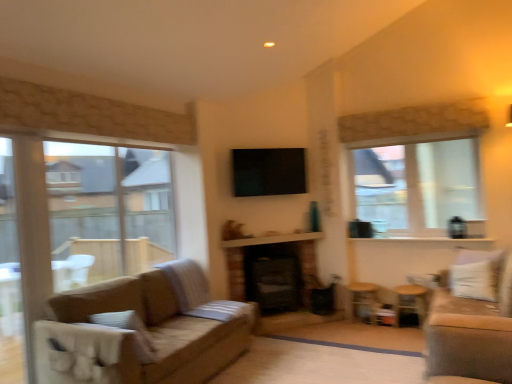
Question: Is white textured balcony at center wider or thinner than wooden side table at lower right, the 2th side table viewed from the left?

Choices:
 (A) wide
 (B) thin

Answer: (B)

Question: In terms of height, does white textured balcony at center look taller or shorter compared to wooden side table at lower right, which appears as the first side table when viewed from the right?

Choices:
 (A) short
 (B) tall

Answer: (A)

Question: Estimate the real-world distances between objects in this image. Which object is farther from the black glossy tv at center?

Choices:
 (A) white textured balcony at center
 (B) clear glass window at upper right, positioned as the first window in right-to-left order
 (C) clear glass window at left, which is counted as the second window, starting from the right
 (D) velvet beige couch at right
 (E) wooden side table at lower right, which is the second side table in right-to-left order

Answer: (D)

Question: Based on their relative distances, which object is nearer to the wooden side table at lower right, the 1th side table from the left?

Choices:
 (A) wooden side table at lower right, the 2th side table viewed from the left
 (B) white textured balcony at center
 (C) velvet beige couch at right
 (D) clear glass window at upper right, positioned as the second window in left-to-right order
 (E) clear glass window at left, which is counted as the second window, starting from the right

Answer: (A)